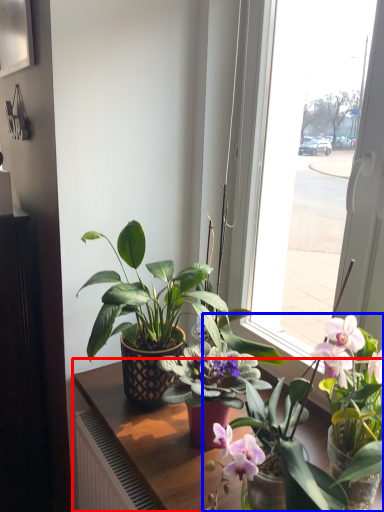
Question: Among these objects, which one is farthest to the camera, table (highlighted by a red box) or houseplant (highlighted by a blue box)?

Choices:
 (A) table
 (B) houseplant

Answer: (A)